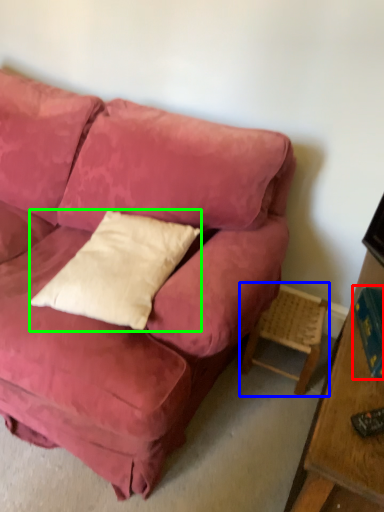
Question: Which object is positioned farthest from book (highlighted by a red box)? Select from side table (highlighted by a blue box) and pillow (highlighted by a green box).

Choices:
 (A) side table
 (B) pillow

Answer: (B)